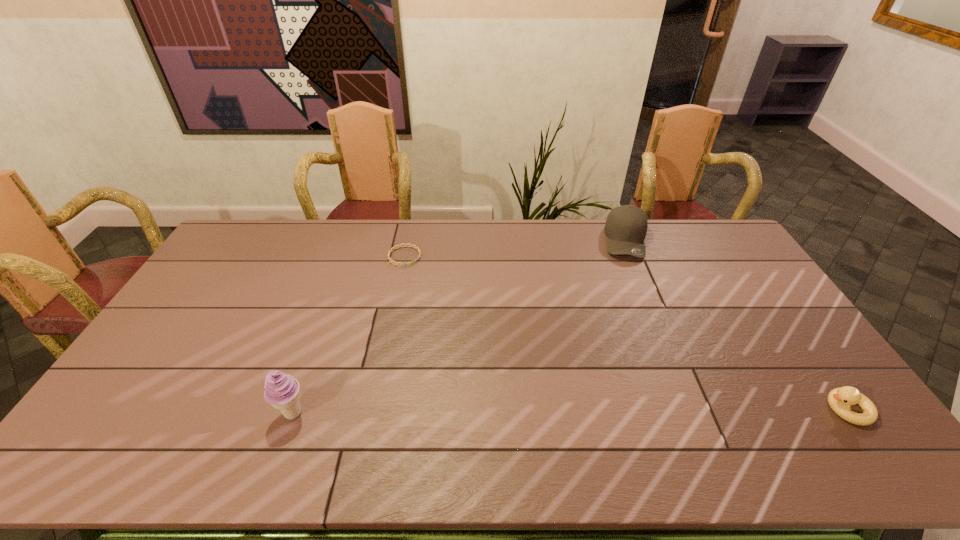
In order to click on icecream present at the near edge in this screenshot , I will do `click(282, 391)`.

Locate an element on the screen. Image resolution: width=960 pixels, height=540 pixels. duckling positioned at the near edge is located at coordinates (840, 399).

Identify the location of object situated at the right edge. (840, 399).

Image resolution: width=960 pixels, height=540 pixels. What are the coordinates of `object positioned at the near right corner` in the screenshot? It's located at (840, 399).

Locate an element on the screen. vacant space at the far edge of the desktop is located at coordinates (356, 238).

In the image, there is a desktop. Where is `free space at the near edge`? Image resolution: width=960 pixels, height=540 pixels. free space at the near edge is located at coordinates (546, 404).

This screenshot has height=540, width=960. Identify the location of vacant space at the left edge of the desktop. (186, 330).

Image resolution: width=960 pixels, height=540 pixels. I want to click on free space at the right edge of the desktop, so click(763, 293).

This screenshot has height=540, width=960. In order to click on vacant area that lies between the icecream and the bracelet in this screenshot , I will do `click(348, 335)`.

You are a GUI agent. You are given a task and a screenshot of the screen. Output one action in this format:
    pyautogui.click(x=<x>, y=<y>)
    Task: Click on the blank region between the tallest object and the duckling
    Image resolution: width=960 pixels, height=540 pixels.
    Given the screenshot: What is the action you would take?
    pyautogui.click(x=569, y=411)